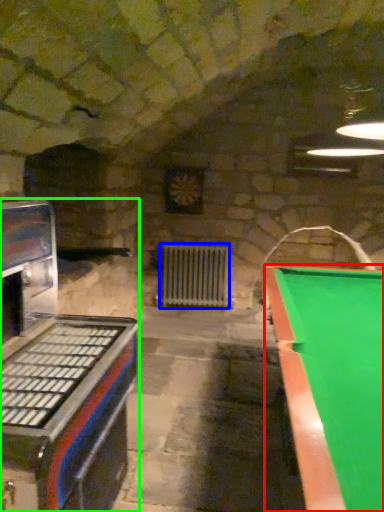
Question: Considering the real-world distances, which object is farthest from billiard table (highlighted by a red box)? radiator (highlighted by a blue box) or appliance (highlighted by a green box)?

Choices:
 (A) radiator
 (B) appliance

Answer: (A)